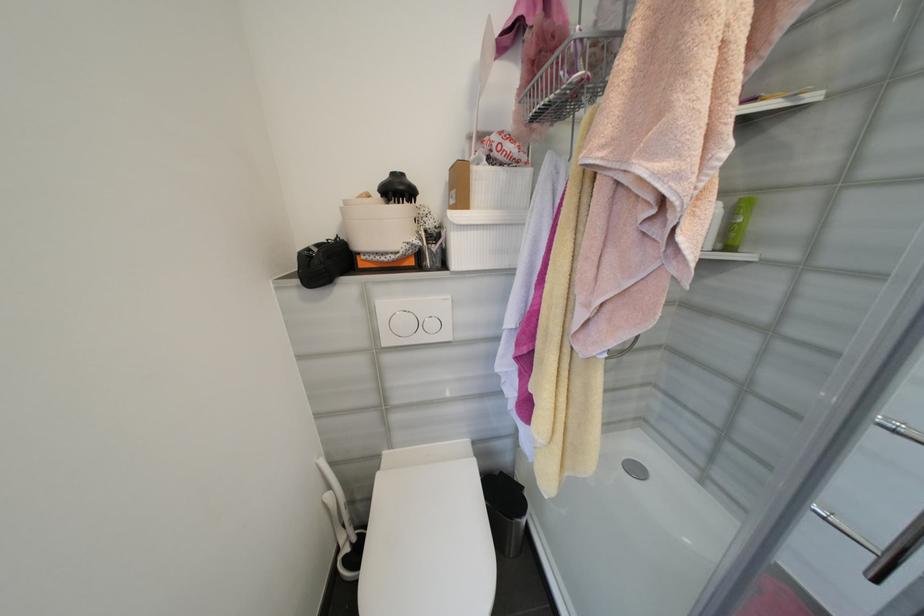
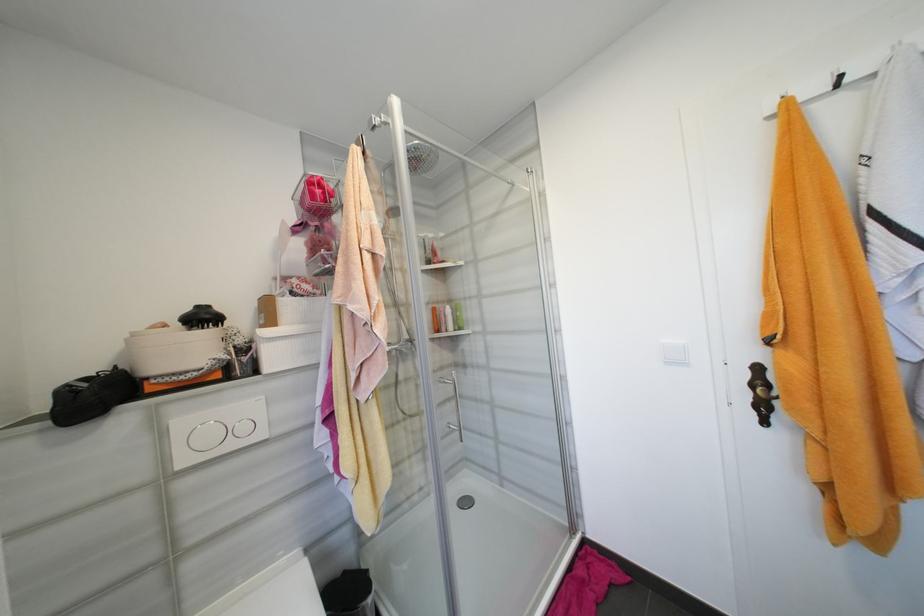
First-person continuous shooting, in which direction is the camera rotating?

The rotation direction of the camera is right-up.